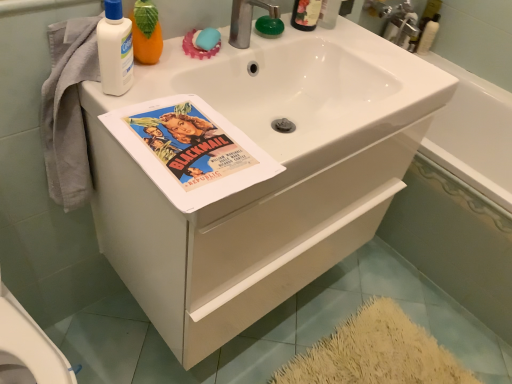
Question: Is white glossy bathtub at upper right, the second bath viewed from the right, facing away from white matte cabinet at center?

Choices:
 (A) yes
 (B) no

Answer: (B)

Question: Could you tell me if white glossy bathtub at upper right, the second bath viewed from the right, is turned towards white matte cabinet at center?

Choices:
 (A) yes
 (B) no

Answer: (B)

Question: Is white matte cabinet at center completely or partially inside white glossy bathtub at upper right, which is the first bath from left to right?

Choices:
 (A) no
 (B) yes

Answer: (A)

Question: Does white glossy bathtub at upper right, which is the first bath from left to right, have a greater width compared to white matte cabinet at center?

Choices:
 (A) no
 (B) yes

Answer: (A)

Question: Considering the relative sizes of white glossy bathtub at upper right, which is the first bath from left to right, and white matte cabinet at center in the image provided, is white glossy bathtub at upper right, which is the first bath from left to right, shorter than white matte cabinet at center?

Choices:
 (A) no
 (B) yes

Answer: (A)

Question: From a real-world perspective, is white glossy bathtub at upper right, the second bath viewed from the right, under white matte cabinet at center?

Choices:
 (A) no
 (B) yes

Answer: (B)

Question: Is white glossy bathtub at center, the 1th bath in the right-to-left sequence, to the left of blue rubber soap at upper center from the viewer's perspective?

Choices:
 (A) yes
 (B) no

Answer: (B)

Question: From the image's perspective, does white glossy bathtub at center, the 1th bath in the right-to-left sequence, appear lower than blue rubber soap at upper center?

Choices:
 (A) no
 (B) yes

Answer: (B)

Question: Does white glossy bathtub at center, the 1th bath in the right-to-left sequence, come behind blue rubber soap at upper center?

Choices:
 (A) no
 (B) yes

Answer: (B)

Question: Would you say blue rubber soap at upper center is part of white glossy bathtub at center, the 2th bath viewed from the left,'s contents?

Choices:
 (A) no
 (B) yes

Answer: (A)

Question: Are white glossy bathtub at center, the 1th bath in the right-to-left sequence, and blue rubber soap at upper center making contact?

Choices:
 (A) no
 (B) yes

Answer: (A)

Question: Does white glossy bathtub at center, the 1th bath in the right-to-left sequence, turn towards blue rubber soap at upper center?

Choices:
 (A) yes
 (B) no

Answer: (B)

Question: From a real-world perspective, is silver metallic faucet at upper center under white matte lotion at upper left, positioned as the 2th cleaning product in right-to-left order?

Choices:
 (A) no
 (B) yes

Answer: (B)